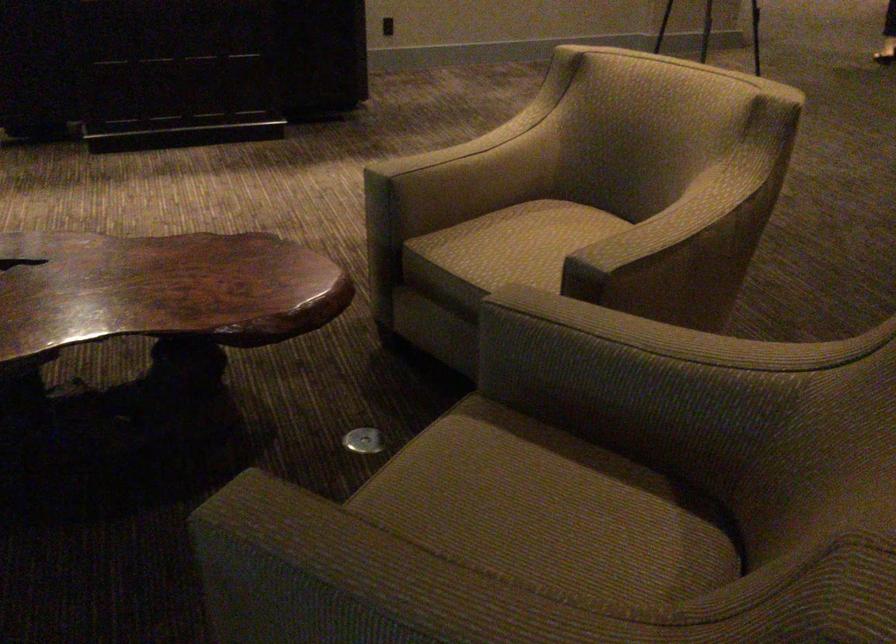
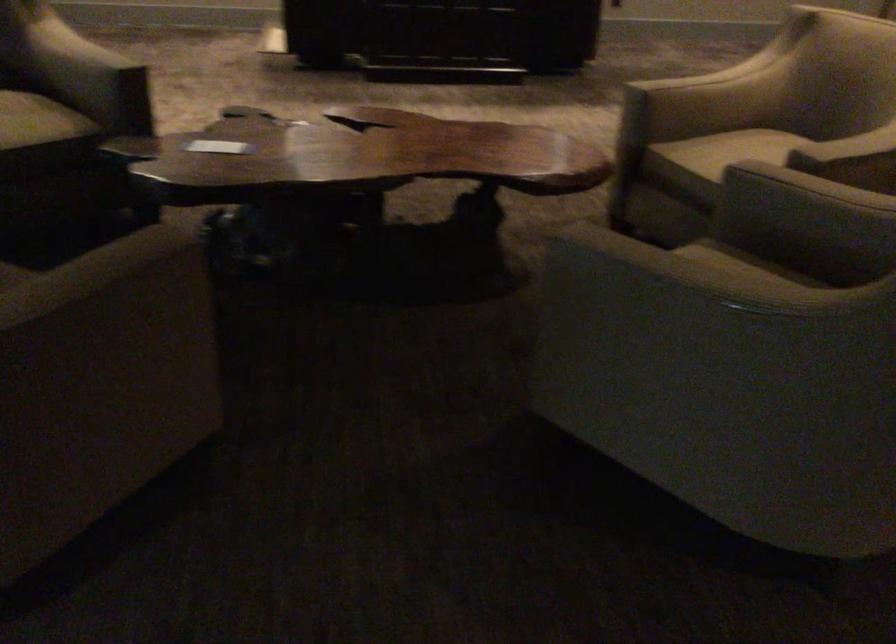
The point at (590, 363) is marked in the first image. Where is the corresponding point in the second image?

(806, 207)